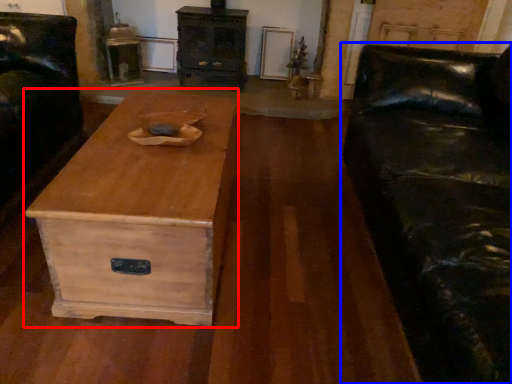
Question: Which object appears closest to the camera in this image, coffee table (highlighted by a red box) or studio couch (highlighted by a blue box)?

Choices:
 (A) coffee table
 (B) studio couch

Answer: (B)